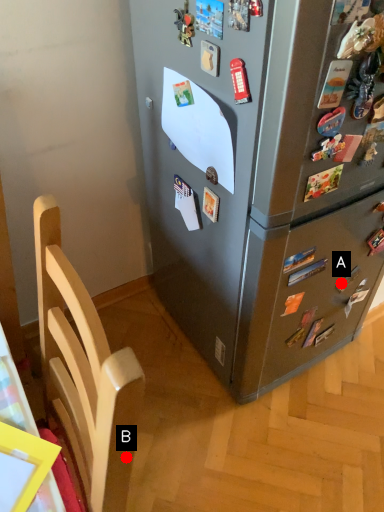
Question: Two points are circled on the image, labeled by A and B beside each circle. Which point is farther to the camera?

Choices:
 (A) A is further
 (B) B is further

Answer: (A)